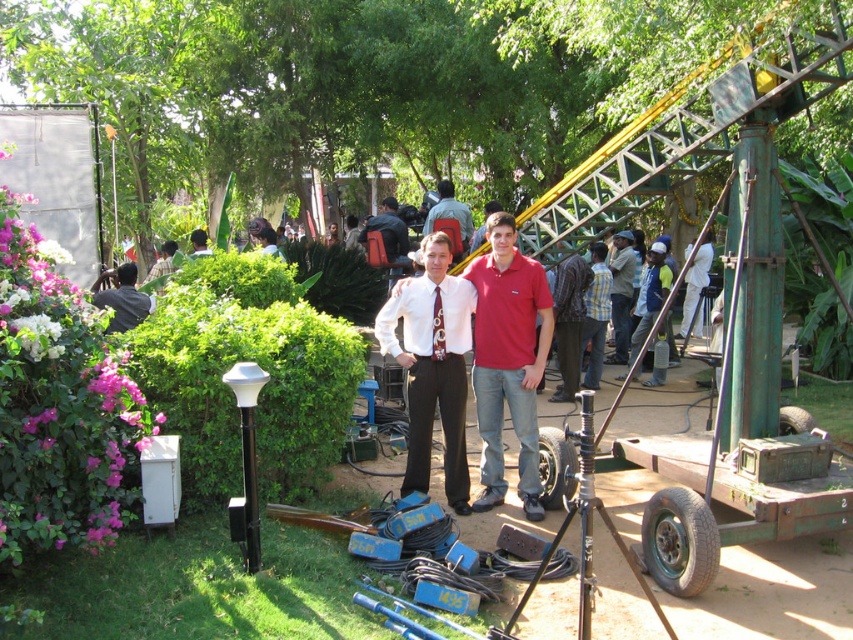
Can you confirm if white glossy shirt at center is thinner than denim jacket at right?

In fact, white glossy shirt at center might be wider than denim jacket at right.

Is point (466, 285) behind point (621, 278)?

No, (466, 285) is closer to viewer.

Where is `white glossy shirt at center`? white glossy shirt at center is located at coordinates (432, 364).

Does denim jacket at right have a greater height compared to light brown leather jacket at upper center?

Correct, denim jacket at right is much taller as light brown leather jacket at upper center.

Does point (612, 292) lie in front of point (167, 248)?

Yes, point (612, 292) is in front of point (167, 248).

Find the location of a particular element. Image resolution: width=853 pixels, height=640 pixels. denim jacket at right is located at coordinates 621,292.

Between denim jacket at right and green fabric backpack at center, which one has more height?

With more height is denim jacket at right.

Who is more distant from viewer, (624, 268) or (460, 216)?

The point (624, 268) is behind.

In order to click on denim jacket at right in this screenshot , I will do `click(621, 292)`.